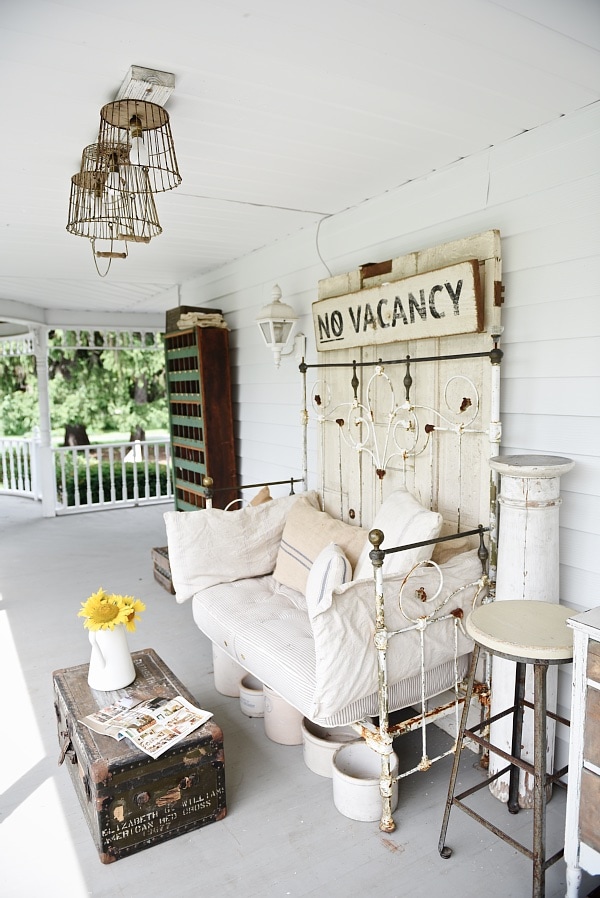
Image resolution: width=600 pixels, height=898 pixels. Identify the location of stool legs. (458, 711), (542, 756), (517, 693).